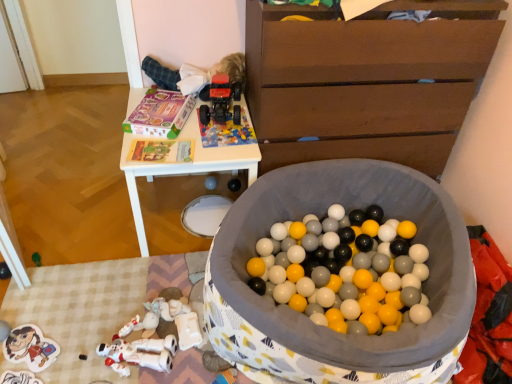
This screenshot has width=512, height=384. What are the coordinates of `free space to the left of white matte plastic robot at lower left, the fifth toy viewed from the right` in the screenshot? It's located at (77, 341).